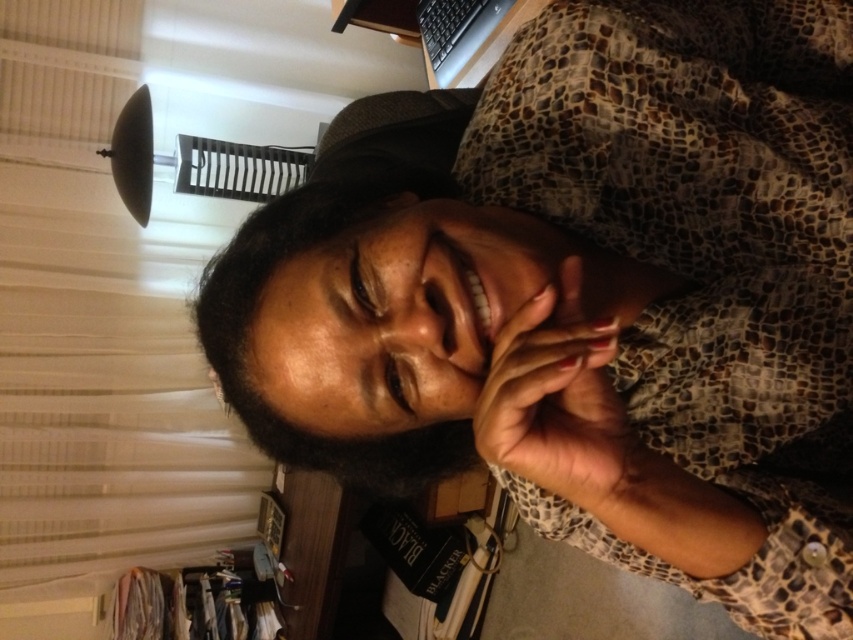
You are standing in the home office and want to reach the point at coordinates (437,340). If your arm can extend 18 inches, can you reach it without moving?

A: The point at coordinates (437,340) is 18.36 inches away from you, so your arm can extend 18 inches, which is slightly shorter. Therefore, you cannot reach it without moving.

You are organizing items on a desk and need to place a new item between the nail polish at center and the black plastic keyboard at upper right. Based on their positions, which object should the new item be closer to?

The new item should be closer to the black plastic keyboard at upper right because the nail polish at center is to the right of the black plastic keyboard at upper right, meaning the keyboard is on the left side relative to the nail polish. Therefore, placing the new item between them would require it to be nearer to the keyboard to maintain the leftward direction.

You are standing in the home office and want to place a small plant between the two points, point (582,362) and point (485,28). Which point should the plant be closer to so it is in front of the other point?

The plant should be closer to point (582,362) because it is in front of point (485,28).